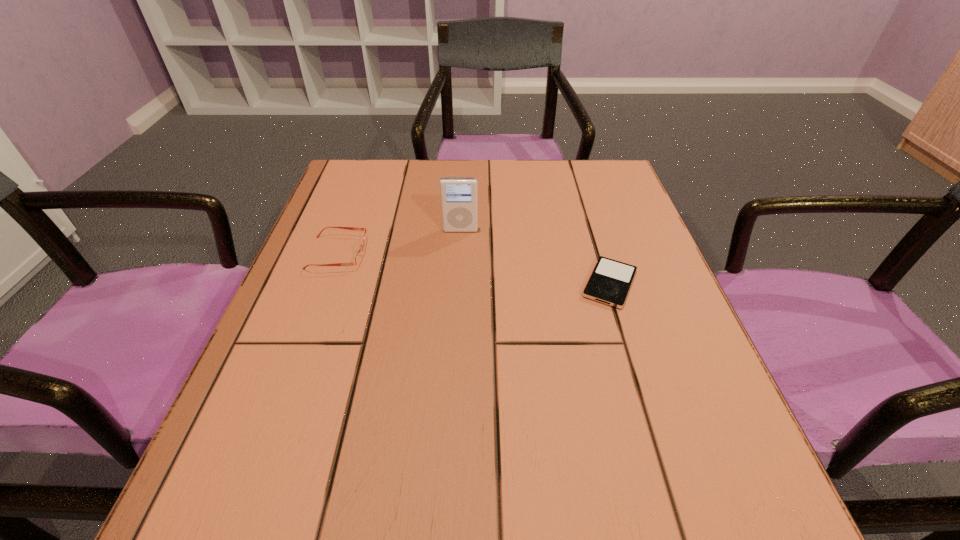
Find the location of a particular element. The height and width of the screenshot is (540, 960). vacant region that satisfies the following two spatial constraints: 1. on the front-facing side of the taller iPod; 2. on the left side of the nearer iPod is located at coordinates [x=458, y=284].